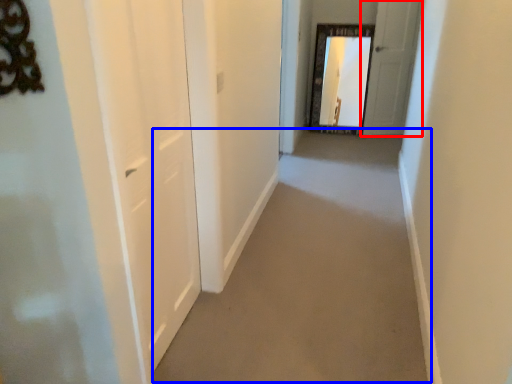
Question: Which point is closer to the camera, door (highlighted by a red box) or path (highlighted by a blue box)?

Choices:
 (A) door
 (B) path

Answer: (B)